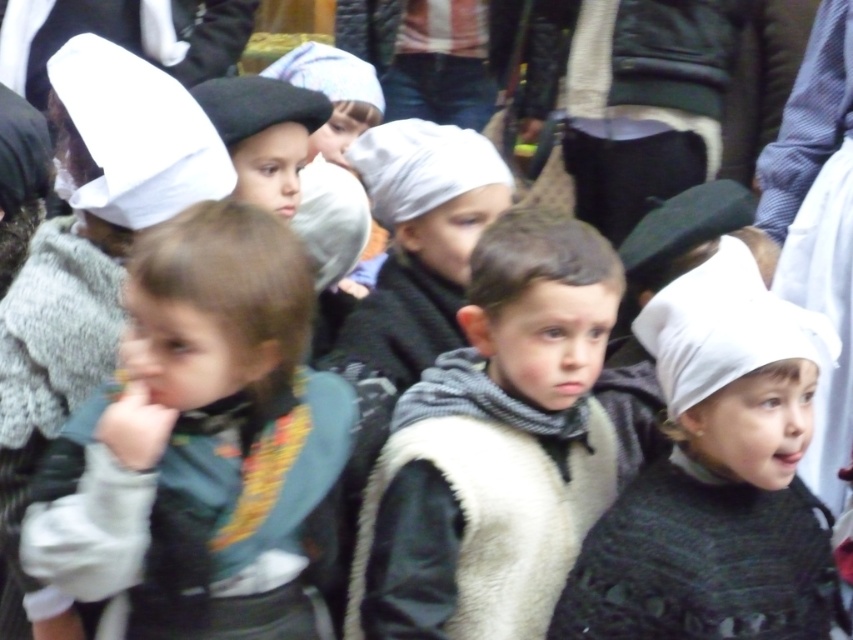
Based on the photo, you are a photographer trying to capture the children in the scene. You notice the dark green sweater at center and the white knitted hat at center. Which object should you focus on to ensure it takes up more of your photo?

The white knitted hat at center should be focused on because it occupies more space than the dark green sweater at center.

Based on the scene description, where is the dark green sweater at center located in terms of coordinates?

The dark green sweater at center is located at coordinates point (198, 442).

You are a photographer trying to capture the children in the center of the image. There is a dark green sweater at center located at point (198, 442). Where should you position your camera to ensure the dark green sweater at center is in the frame?

Position your camera so that the dark green sweater at center is centered at point (198, 442) to include it in the frame.